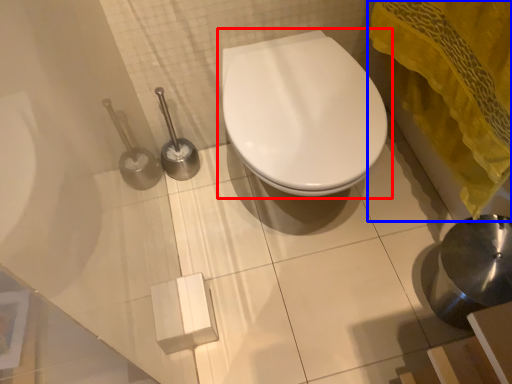
Question: Among these objects, which one is farthest to the camera, toilet (highlighted by a red box) or bath towel (highlighted by a blue box)?

Choices:
 (A) toilet
 (B) bath towel

Answer: (A)